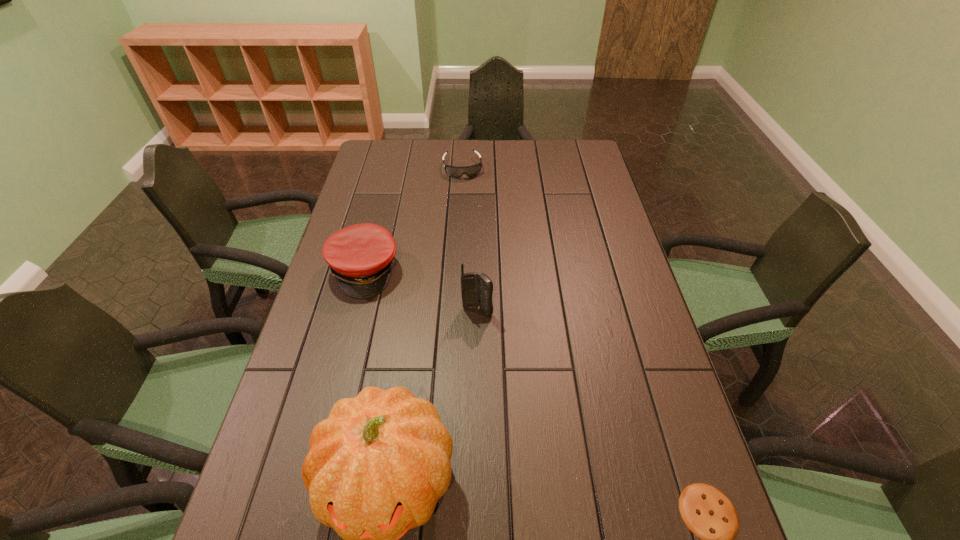
At what (x,y) coordinates should I click in order to perform the action: click on vacant space at the right edge of the desktop. Please return your answer as a coordinate pair (x, y). Image resolution: width=960 pixels, height=540 pixels. Looking at the image, I should click on (588, 248).

Identify the location of free space at the far left corner. This screenshot has height=540, width=960. (381, 145).

Image resolution: width=960 pixels, height=540 pixels. What are the coordinates of `empty location between the goggles and the cellular telephone` in the screenshot? It's located at (470, 239).

This screenshot has width=960, height=540. I want to click on free space between the third tallest object and the goggles, so click(x=414, y=219).

Select which object appears as the fourth closest to the pumpkin. Please provide its 2D coordinates. Your answer should be formatted as a tuple, i.e. [(x, y)], where the tuple contains the x and y coordinates of a point satisfying the conditions above.

[(470, 171)]

This screenshot has height=540, width=960. I want to click on the third closest object to the cap, so click(x=470, y=171).

Locate an element on the screen. free space that satisfies the following two spatial constraints: 1. on the back side of the fourth tallest object; 2. on the right side of the third shortest object is located at coordinates (391, 168).